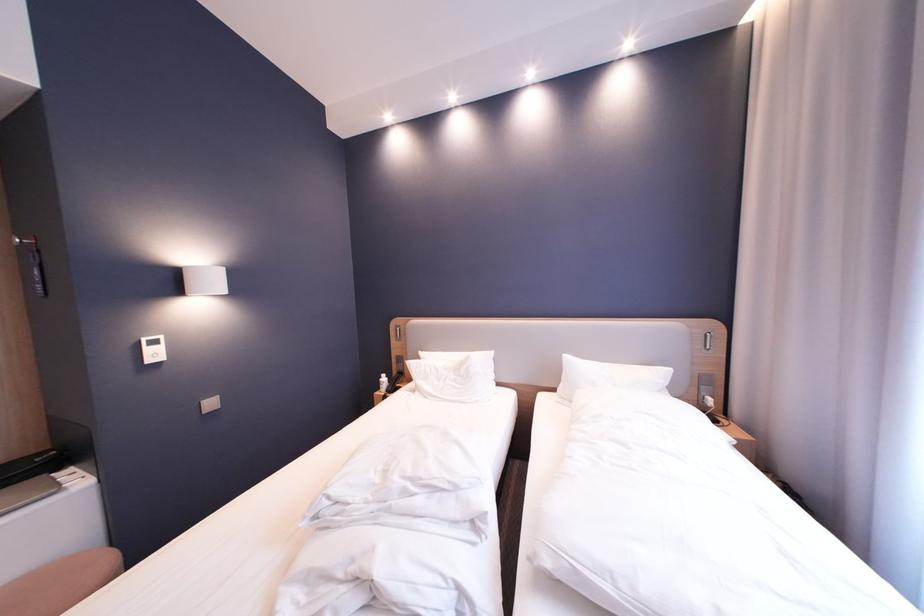
Find where to push the white thermostat control. Please return your answer as a coordinate pair (x, y).

(152, 349)